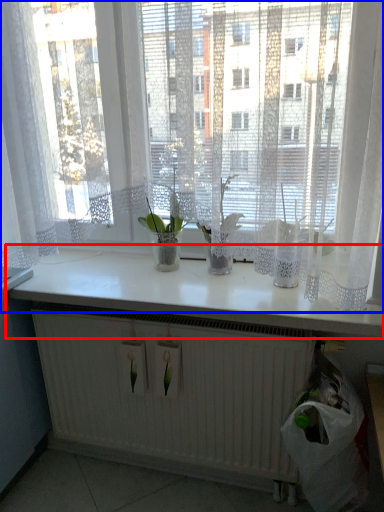
Question: Which of the following is the closest to the observer, counter top (highlighted by a red box) or curtain (highlighted by a blue box)?

Choices:
 (A) counter top
 (B) curtain

Answer: (B)